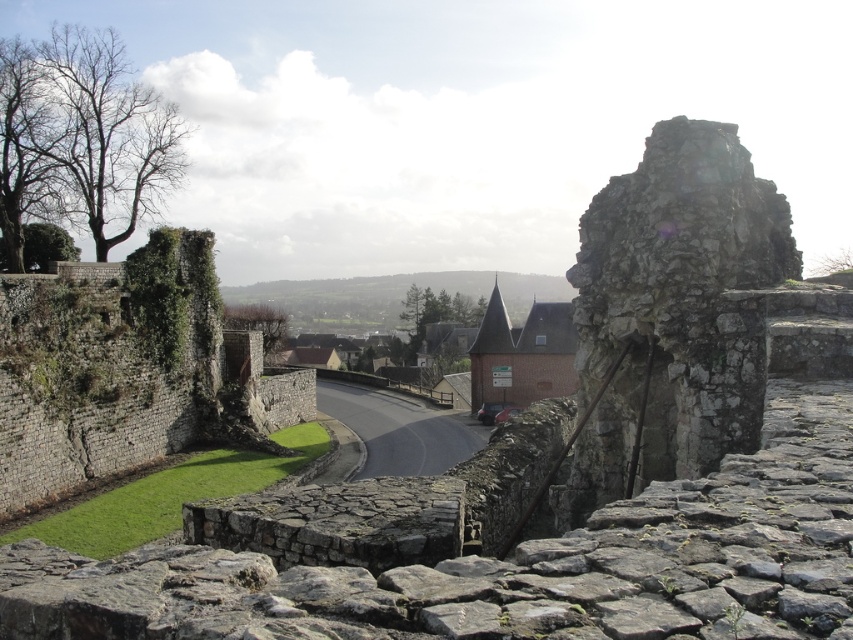
The width and height of the screenshot is (853, 640). Describe the element at coordinates (126, 371) in the screenshot. I see `green mossy stone wall at left` at that location.

Locate an element on the screen. This screenshot has width=853, height=640. green mossy stone wall at left is located at coordinates (126, 371).

Measure the distance between point (59, 476) and camera.

Point (59, 476) is 52.83 meters from camera.

Locate an element on the screen. Image resolution: width=853 pixels, height=640 pixels. green mossy stone wall at left is located at coordinates (126, 371).